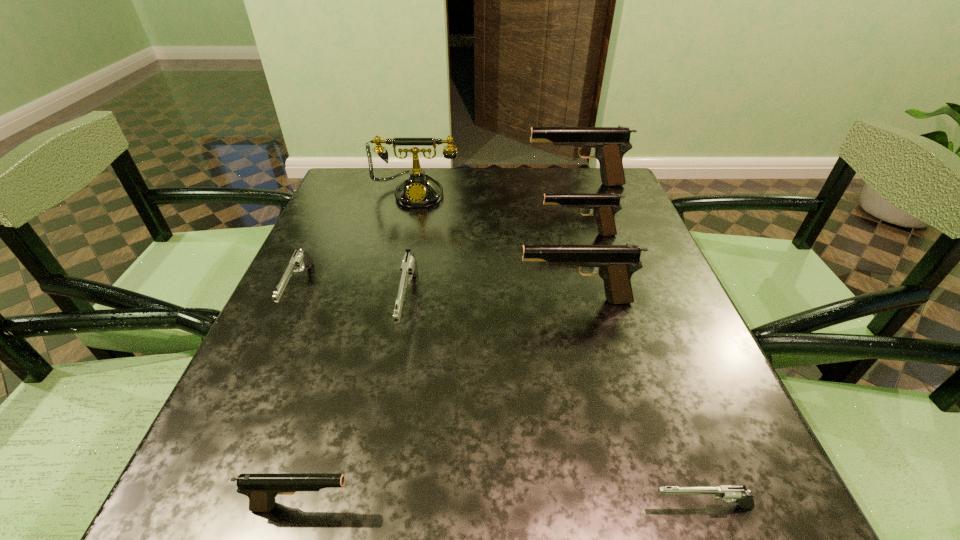
In the image, there is a desktop. At what (x,y) coordinates should I click in order to perform the action: click on vacant space at the left edge. Please return your answer as a coordinate pair (x, y). Image resolution: width=960 pixels, height=540 pixels. Looking at the image, I should click on (327, 364).

Find the location of a particular element. The width and height of the screenshot is (960, 540). vacant space at the far left corner is located at coordinates (348, 174).

You are a GUI agent. You are given a task and a screenshot of the screen. Output one action in this format:
    pyautogui.click(x=<x>, y=<y>)
    Task: Click on the vacant space at the far right corner of the desktop
    
    Given the screenshot: What is the action you would take?
    pyautogui.click(x=563, y=176)

Find the location of a particular element. The width and height of the screenshot is (960, 540). vacant point located between the smallest black pistol and the biggest black pistol is located at coordinates (440, 345).

Identify the location of vacant space in between the second nearest black pistol and the sixth pistol from right to left. (440, 403).

In order to click on empty space between the leftmost pistol and the telephone in this screenshot , I will do `click(358, 241)`.

Find the location of a particular element. This screenshot has width=960, height=540. vacant area between the fifth shortest object and the smallest silver pistol is located at coordinates (639, 370).

The width and height of the screenshot is (960, 540). I want to click on free space between the shortest object and the biggest black pistol, so click(638, 346).

Locate an element on the screen. vacant area that lies between the leftmost pistol and the sixth nearest object is located at coordinates (439, 262).

Where is `free space that is in between the sixth pistol from right to left and the fifth shortest object`? The height and width of the screenshot is (540, 960). free space that is in between the sixth pistol from right to left and the fifth shortest object is located at coordinates (441, 370).